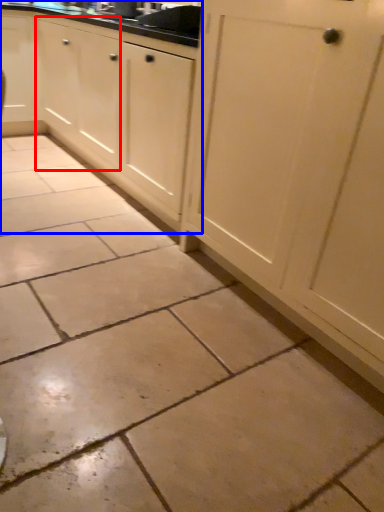
Question: Among these objects, which one is farthest to the camera, cabinetry (highlighted by a red box) or cabinetry (highlighted by a blue box)?

Choices:
 (A) cabinetry
 (B) cabinetry

Answer: (A)